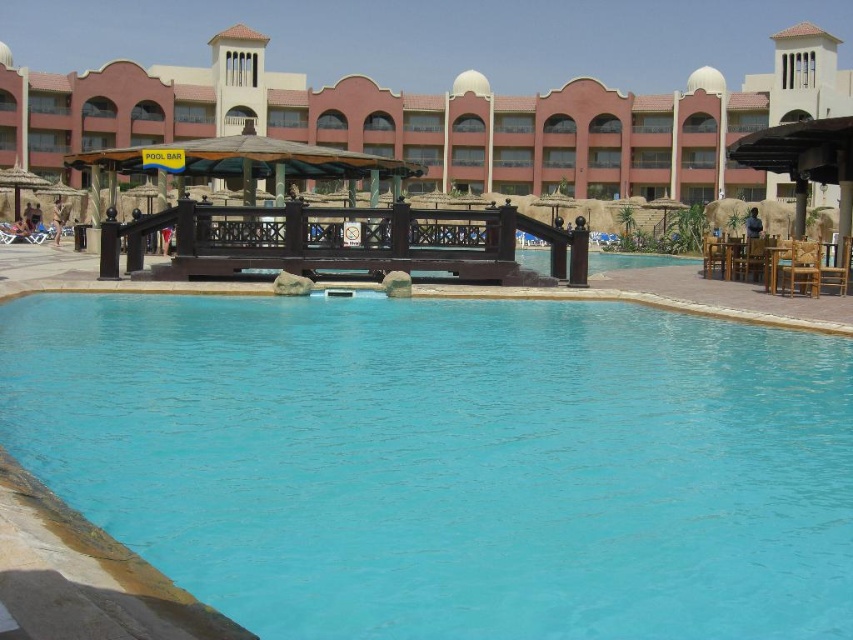
You are standing at the center of the paved area around the turquoise swimming pool. You need to locate the blue smooth water at center. According to the coordinates provided, where exactly should you look to find it?

The blue smooth water at center is located at point 0.722 on the x axis and 0.528 on the y axis.

You are standing at the edge of the turquoise swimming pool in the image. If you look towards the point marked at coordinates (450, 461), what will you see?

At the coordinates (450, 461), you will see blue smooth water at center, as indicated by the point.